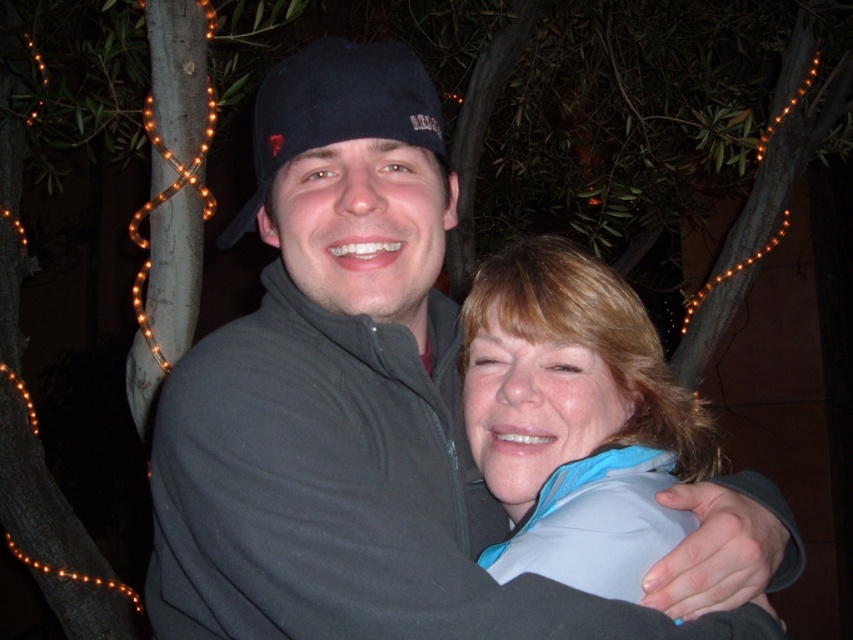
You are a photographer setting up a camera to capture the scene. You notice two fabrics in the image, the dark gray fleece at center and the blue fabric at center. Which fabric should you focus on first to ensure both are in sharp focus?

The dark gray fleece at center is in front of the blue fabric at center, so you should focus on the dark gray fleece at center first to ensure both are in sharp focus.

You are a photographer adjusting the focus on your camera. You want to ensure both the dark gray fleece at center and the blue fabric at center are in focus. The camera has a depth of field that can cover 15 centimeters. Will both objects be in focus?

The distance between dark gray fleece at center and blue fabric at center is 15.65 centimeters. Since the camera can only cover 15 centimeters, the blue fabric at center and dark gray fleece at center will not both be in focus.

You are a photographer trying to capture a candid shot of two people standing near a tree with orange lights. You notice two points in the scene labeled as point (x=367, y=54) and point (x=509, y=385). Which point should you focus on to ensure the subject closer to the camera is in sharp focus?

Point (x=367, y=54) should be focused on because it is in front of point (x=509, y=385), making it closer to the camera and thus the subject to prioritize for sharp focus.